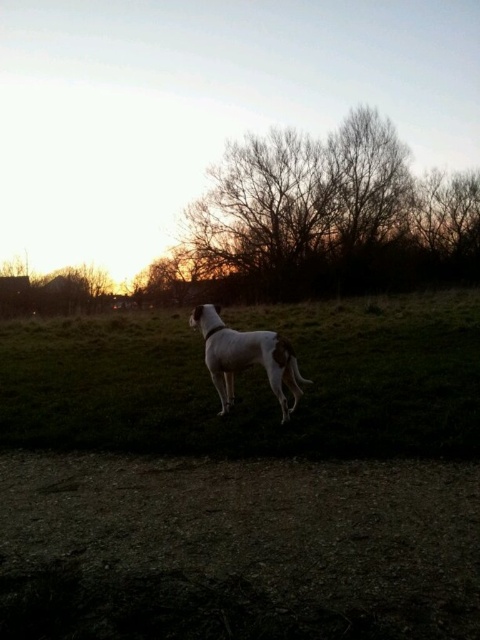
You are standing at the point labeled point (262, 204) and want to walk to the point labeled point (292, 444). Given the slope of the terrain in the scene, will you be walking uphill or downhill?

Since point (292, 444) is in front of point (262, 204), you will be walking uphill towards it as the terrain slopes upwards towards the trees in the distance.

You are a photographer trying to capture the sunset in this scene. You have a camera with a 50mm lens that has a field of view of about 46 degrees. You want to frame the scene so that both the green grass at center and the white fur dog at center are visible in the shot. Considering their sizes, which object should you focus on to ensure both are in the frame?

The green grass at center is bigger than the white fur dog at center, so focusing on the larger green grass at center will help ensure both objects are within the camera frame.

You are a gardener planning to plant a new flower bed. You see the green grass at center and the bare branches at upper center. Which object is located to the left of the other?

The green grass at center is positioned on the left side of bare branches at upper center.